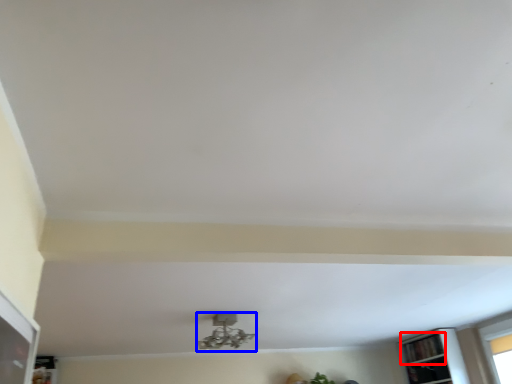
Question: Which object is further to the camera taking this photo, shelf (highlighted by a red box) or lamp (highlighted by a blue box)?

Choices:
 (A) shelf
 (B) lamp

Answer: (A)